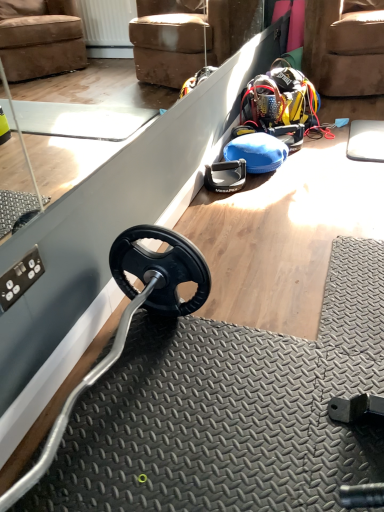
Question: Is black rubber weight at center bigger than brown suede armchair at upper right?

Choices:
 (A) yes
 (B) no

Answer: (B)

Question: Can you confirm if black rubber weight at center is positioned to the right of brown suede armchair at upper right?

Choices:
 (A) yes
 (B) no

Answer: (B)

Question: Is black rubber weight at center positioned in front of brown suede armchair at upper right?

Choices:
 (A) yes
 (B) no

Answer: (A)

Question: From the image's perspective, does black rubber weight at center appear lower than brown suede armchair at upper right?

Choices:
 (A) no
 (B) yes

Answer: (B)

Question: Can you confirm if black rubber weight at center is taller than brown suede armchair at upper right?

Choices:
 (A) no
 (B) yes

Answer: (A)

Question: Is black rubber weight at center in contact with brown suede armchair at upper right?

Choices:
 (A) yes
 (B) no

Answer: (B)

Question: Considering the relative sizes of brown suede armchair at upper right and black rubber weight at center in the image provided, is brown suede armchair at upper right shorter than black rubber weight at center?

Choices:
 (A) no
 (B) yes

Answer: (A)

Question: Are brown suede armchair at upper right and black rubber weight at center beside each other?

Choices:
 (A) yes
 (B) no

Answer: (B)

Question: Is brown suede armchair at upper right positioned beyond the bounds of black rubber weight at center?

Choices:
 (A) no
 (B) yes

Answer: (B)

Question: From a real-world perspective, is brown suede armchair at upper right located beneath black rubber weight at center?

Choices:
 (A) no
 (B) yes

Answer: (A)

Question: Is brown suede armchair at upper right oriented away from black rubber weight at center?

Choices:
 (A) no
 (B) yes

Answer: (A)

Question: Considering the relative positions of brown suede armchair at upper right and black rubber weight at center in the image provided, is brown suede armchair at upper right to the right of black rubber weight at center from the viewer's perspective?

Choices:
 (A) no
 (B) yes

Answer: (B)

Question: In terms of height, does brown suede armchair at upper right look taller or shorter compared to black rubber weight at center?

Choices:
 (A) short
 (B) tall

Answer: (B)